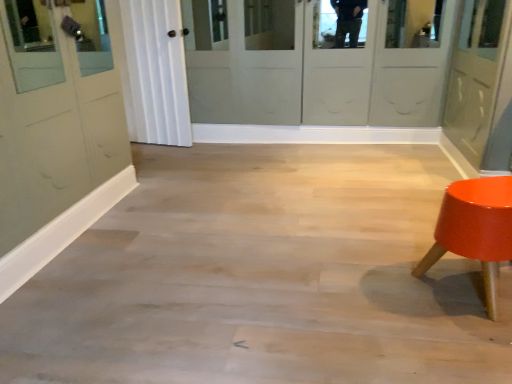
The height and width of the screenshot is (384, 512). Identify the location of vacant space situated on the left part of shiny orange stool at right. (369, 292).